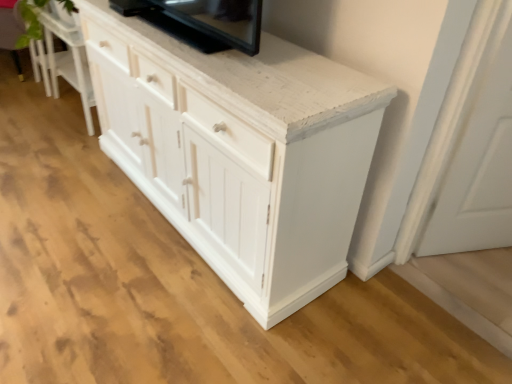
Question: From the image's perspective, is white wood cabinet at lower left located above or below white matte door at lower right?

Choices:
 (A) above
 (B) below

Answer: (A)

Question: Relative to white matte door at lower right, is white wood cabinet at lower left in front or behind?

Choices:
 (A) behind
 (B) front

Answer: (A)

Question: Estimate the real-world distances between objects in this image. Which object is farther from the white painted wood cabinet at center?

Choices:
 (A) white matte door at lower right
 (B) black glossy tv at upper center
 (C) white wood cabinet at lower left
 (D) green leafy plant at upper left

Answer: (D)

Question: Which object is the closest to the white painted wood cabinet at center?

Choices:
 (A) white wood cabinet at lower left
 (B) green leafy plant at upper left
 (C) black glossy tv at upper center
 (D) white matte door at lower right

Answer: (C)